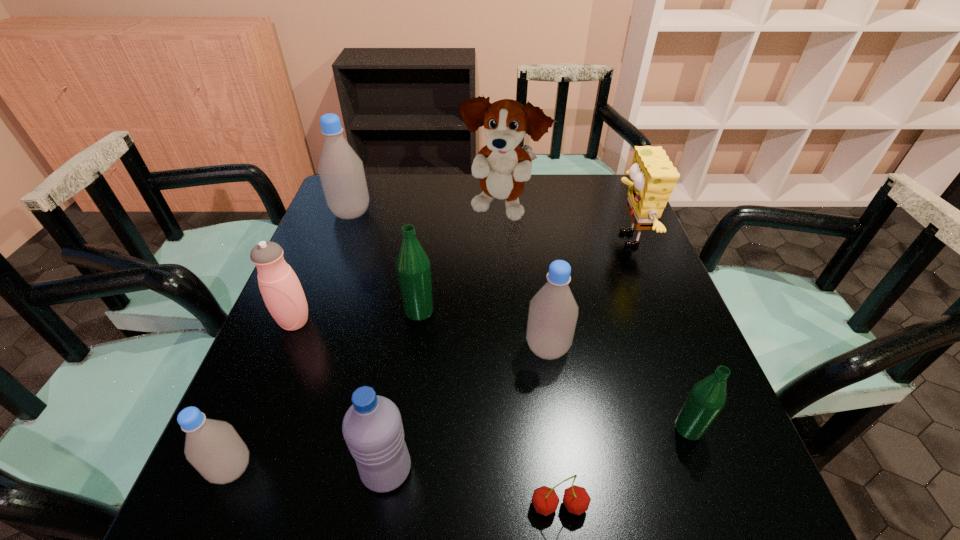
Find the location of a particular element. The height and width of the screenshot is (540, 960). vacant region between the rightmost bottle and the thermos bottle is located at coordinates (492, 375).

You are a GUI agent. You are given a task and a screenshot of the screen. Output one action in this format:
    pyautogui.click(x=<x>, y=<y>)
    Task: Click on the unoccupied area between the yellow sponge and the brown puppy
    
    Given the screenshot: What is the action you would take?
    pyautogui.click(x=564, y=225)

Image resolution: width=960 pixels, height=540 pixels. I want to click on vacant point located between the yellow sponge and the smaller green bottle, so click(x=658, y=334).

This screenshot has height=540, width=960. In order to click on the eighth closest object relative to the nearest bottle in this screenshot , I will do `click(707, 398)`.

The image size is (960, 540). Identify the location of the third closest object relative to the second farthest gray bottle. (652, 180).

Point out which bottle is positioned as the third nearest to the yellow sponge. Please provide its 2D coordinates. Your answer should be formatted as a tuple, i.e. [(x, y)], where the tuple contains the x and y coordinates of a point satisfying the conditions above.

[(413, 268)]

This screenshot has width=960, height=540. I want to click on bottle that is the fifth closest to the thermos bottle, so click(x=707, y=398).

The width and height of the screenshot is (960, 540). Find the location of `gray bottle that is the second closest to the thermos bottle`. gray bottle that is the second closest to the thermos bottle is located at coordinates (341, 171).

Select which gray bottle is the third closest to the cherry. Please provide its 2D coordinates. Your answer should be formatted as a tuple, i.e. [(x, y)], where the tuple contains the x and y coordinates of a point satisfying the conditions above.

[(341, 171)]

The height and width of the screenshot is (540, 960). What are the coordinates of `free space in the image that satisfies the following two spatial constraints: 1. on the face of the second farthest gray bottle; 2. on the left side of the brown puppy` in the screenshot? It's located at (509, 348).